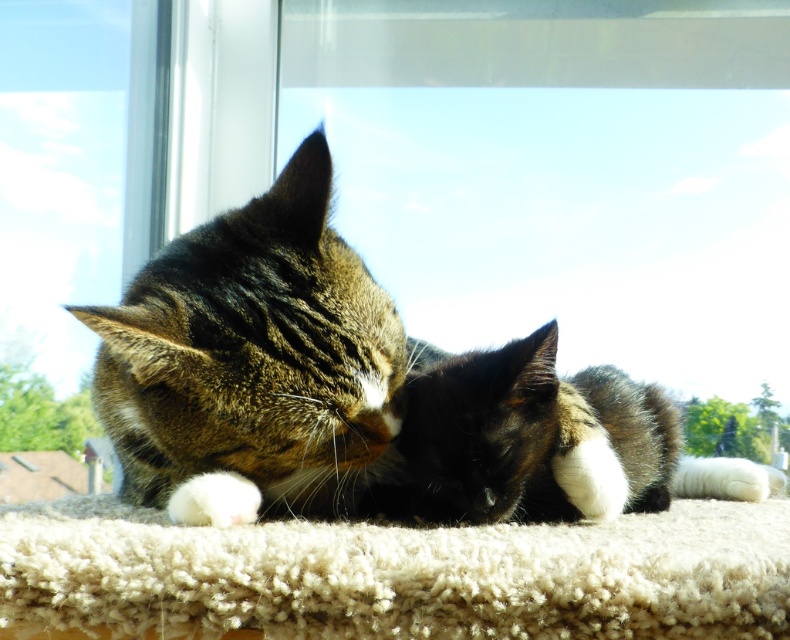
Is tabby fur cat at center positioned behind black fur at center?

No, tabby fur cat at center is in front of black fur at center.

Can you confirm if tabby fur cat at center is wider than black fur at center?

Yes, tabby fur cat at center is wider than black fur at center.

Is point (145, 342) closer to camera compared to point (623, 404)?

Yes, point (145, 342) is in front of point (623, 404).

The image size is (790, 640). What are the coordinates of `tabby fur cat at center` in the screenshot? It's located at (360, 392).

Which is more to the right, beige shaggy carpet at lower center or black fur at center?

black fur at center

Is point (777, 572) in front of point (604, 484)?

Yes, point (777, 572) is in front of point (604, 484).

Between point (341, 541) and point (480, 515), which one is positioned in front?

Point (341, 541)

Image resolution: width=790 pixels, height=640 pixels. I want to click on beige shaggy carpet at lower center, so click(x=399, y=573).

What do you see at coordinates (360, 392) in the screenshot? I see `tabby fur cat at center` at bounding box center [360, 392].

Is tabby fur cat at center positioned at the back of beige shaggy carpet at lower center?

Yes, tabby fur cat at center is further from the viewer.

The height and width of the screenshot is (640, 790). In order to click on tabby fur cat at center in this screenshot , I will do click(360, 392).

Where is `tabby fur cat at center`? The height and width of the screenshot is (640, 790). tabby fur cat at center is located at coordinates (360, 392).